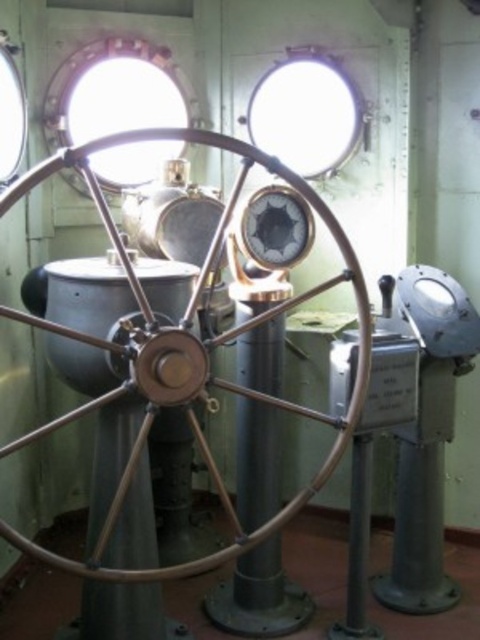
You are standing in the control room and need to determine which of the two points, point (237,200) or point (73,96), is nearer to you. Based on the scene description, which point is closer?

Answer: Point (237,200) is closer to the camera than point (73,96), so it is the nearer one.

You are a maintenance worker in the control room. You need to inspect the clear glass porthole at upper left. Given that your ladder is 3 meters long, can you safely reach it from the floor?

The clear glass porthole at upper left is 2.92 meters away from the camera, so yes, the ladder can reach it since it is slightly shorter than the ladder length.